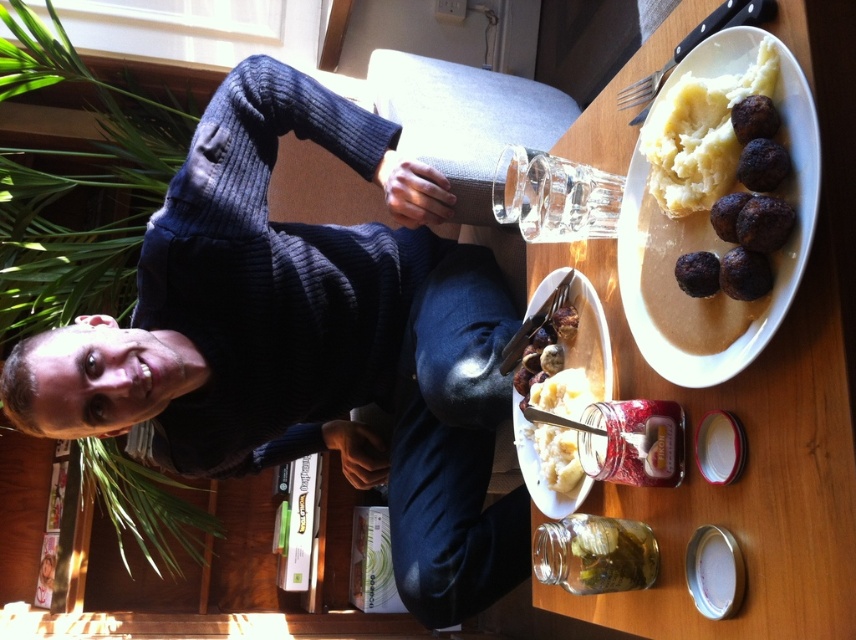
Question: Which object appears farthest from the camera in this image?

Choices:
 (A) white creamy mashed potato at center
 (B) white matte mashed potatoes at center
 (C) white ceramic plate at upper center

Answer: (A)

Question: Among these objects, which one is farthest from the camera?

Choices:
 (A) white creamy mashed potato at center
 (B) white matte mashed potatoes at center
 (C) smooth white mashed potato at upper right
 (D) dark blue ribbed sweater at upper center

Answer: (D)

Question: Observing the image, what is the correct spatial positioning of brown matte meatballs at upper right in reference to smooth white mashed potato at upper right?

Choices:
 (A) left
 (B) right

Answer: (B)

Question: Does white ceramic plate at upper center appear on the left side of smooth white mashed potato at upper right?

Choices:
 (A) yes
 (B) no

Answer: (A)

Question: Is white ceramic plate at upper center behind white creamy mashed potato at center?

Choices:
 (A) yes
 (B) no

Answer: (B)

Question: Among these points, which one is nearest to the camera?

Choices:
 (A) (706, 163)
 (B) (682, 579)

Answer: (A)